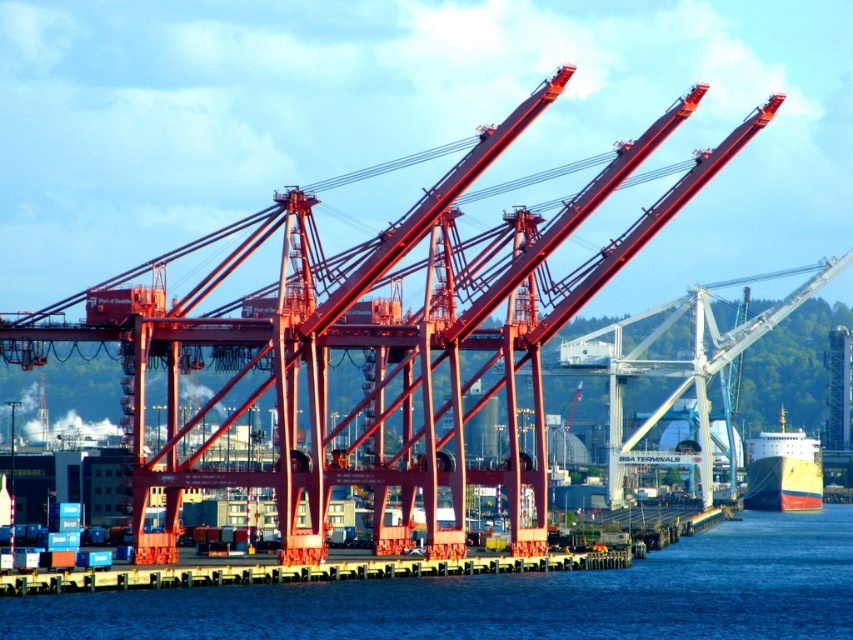
Measure the distance between yellow matte dock at lower center and yellow matte ship at lower right.

yellow matte dock at lower center and yellow matte ship at lower right are 501.79 feet apart from each other.

Does yellow matte dock at lower center appear over yellow matte ship at lower right?

Correct, yellow matte dock at lower center is located above yellow matte ship at lower right.

Who is more distant from viewer, (22, 579) or (784, 486)?

The point (784, 486) is behind.

Locate an element on the screen. yellow matte dock at lower center is located at coordinates (299, 572).

Which is above, blue water at lower center or yellow matte dock at lower center?

Positioned higher is yellow matte dock at lower center.

From the picture: Is blue water at lower center positioned behind yellow matte dock at lower center?

No, blue water at lower center is in front of yellow matte dock at lower center.

Which is in front, point (160, 612) or point (131, 582)?

Positioned in front is point (160, 612).

The height and width of the screenshot is (640, 853). I want to click on blue water at lower center, so click(511, 596).

Does blue water at lower center have a lesser height compared to yellow matte ship at lower right?

Yes.

The height and width of the screenshot is (640, 853). What do you see at coordinates (511, 596) in the screenshot?
I see `blue water at lower center` at bounding box center [511, 596].

The width and height of the screenshot is (853, 640). Describe the element at coordinates (511, 596) in the screenshot. I see `blue water at lower center` at that location.

Identify the location of blue water at lower center. The height and width of the screenshot is (640, 853). (511, 596).